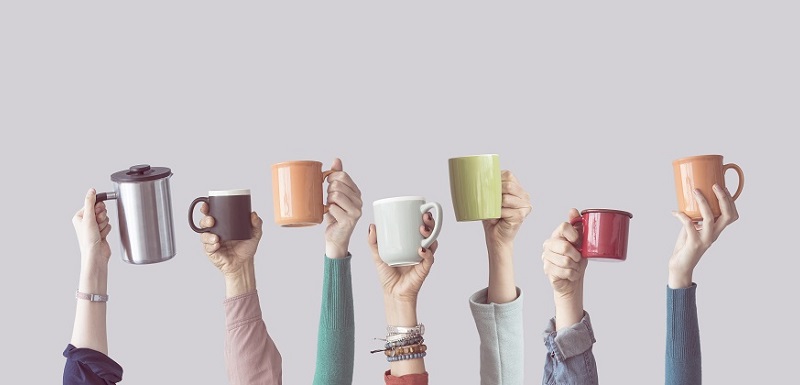
This screenshot has height=385, width=800. I want to click on mugs, so click(141, 210), click(221, 209), click(304, 182), click(386, 217), click(486, 192), click(622, 231), click(684, 170).